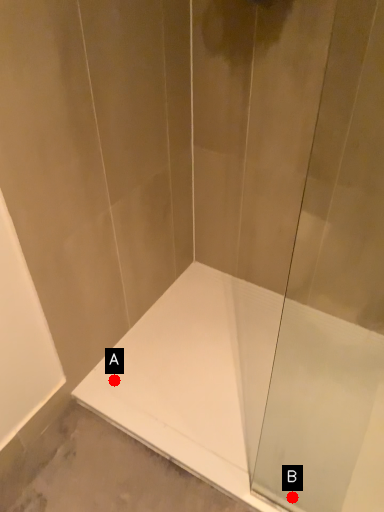
Question: Two points are circled on the image, labeled by A and B beside each circle. Which point is closer to the camera?

Choices:
 (A) A is closer
 (B) B is closer

Answer: (B)